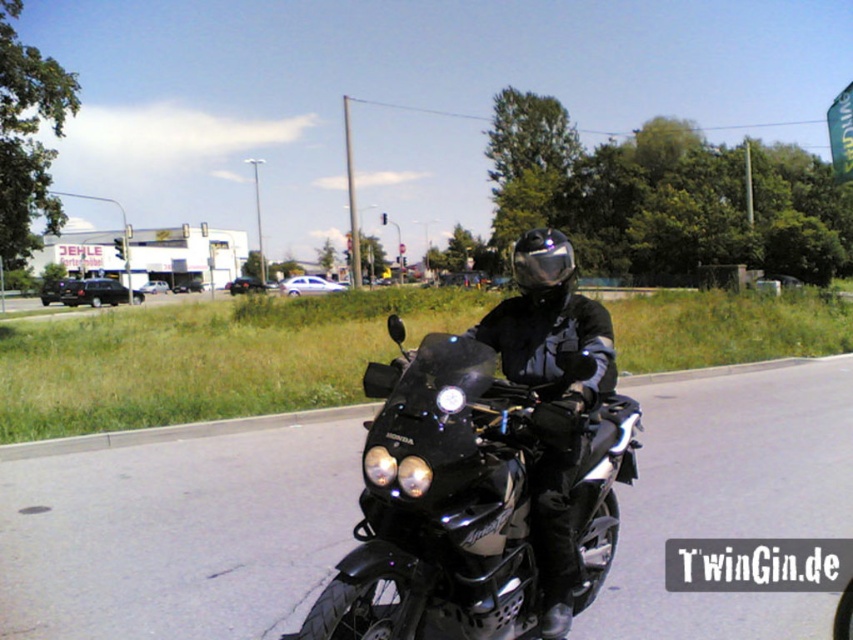
Is black matte motorcycle at center shorter than shiny black helmet at center?

Yes.

Does point (480, 554) lie in front of point (520, 288)?

Yes, it is.

I want to click on black matte motorcycle at center, so click(x=471, y=497).